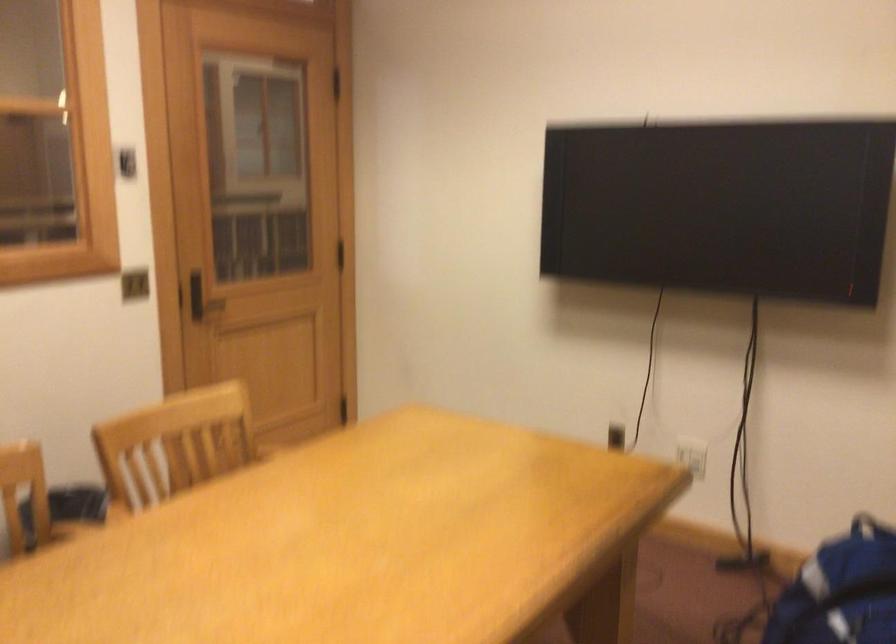
This screenshot has width=896, height=644. Describe the element at coordinates (202, 301) in the screenshot. I see `a black door handle` at that location.